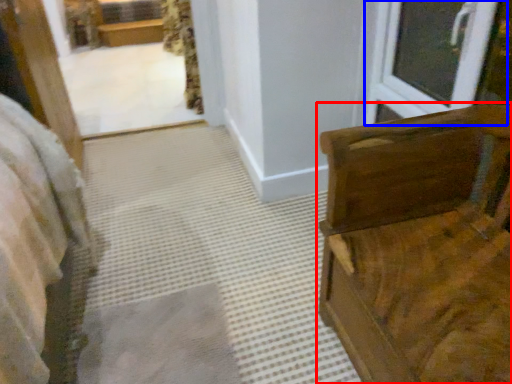
Question: Which of the following is the farthest to the observer, furniture (highlighted by a red box) or window (highlighted by a blue box)?

Choices:
 (A) furniture
 (B) window

Answer: (B)